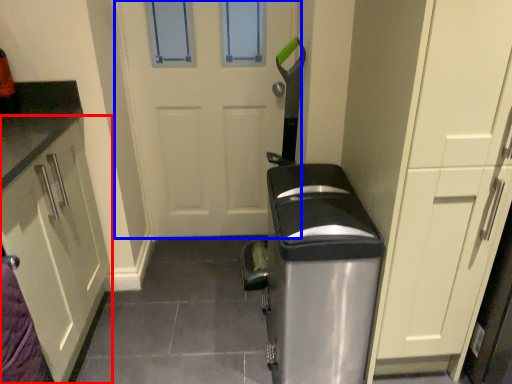
Question: Which object is closer to the camera taking this photo, cabinetry (highlighted by a red box) or door (highlighted by a blue box)?

Choices:
 (A) cabinetry
 (B) door

Answer: (A)